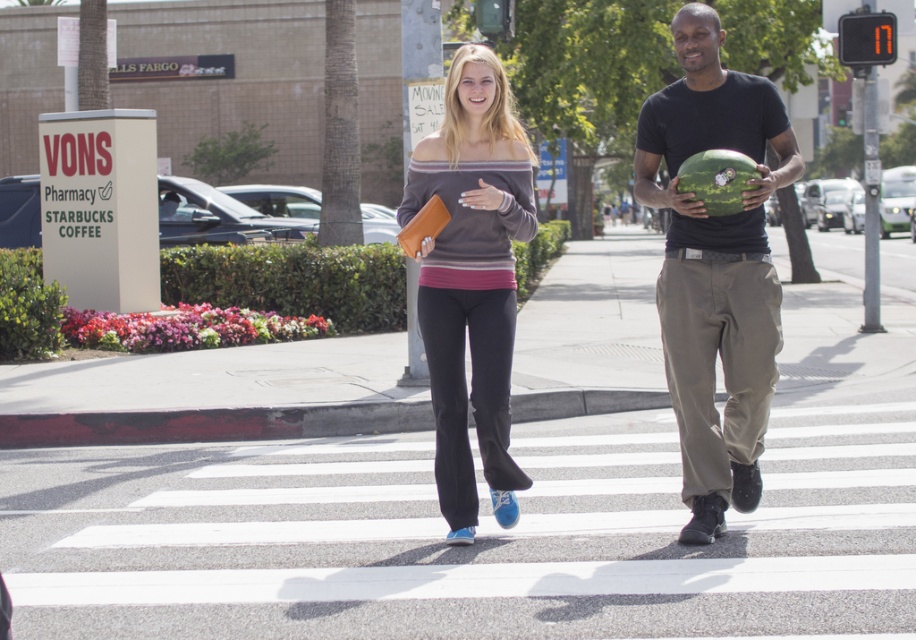
You are a pedestrian standing at the crosswalk. You see a point marked at coordinates (472, 280). Which object is this point located on?

The point at coordinates (472, 280) is located on the matte gray sweater at center.